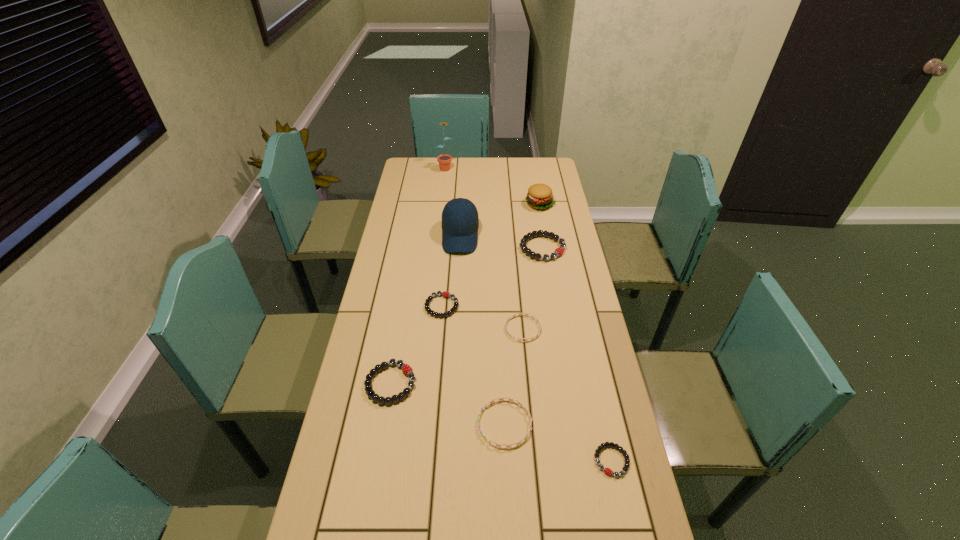
I want to click on blue bracelet that is the second closest to the baseball cap, so click(x=490, y=402).

Locate an element on the screen. blank space that satisfies the following two spatial constraints: 1. on the front-facing side of the blue baseball cap; 2. on the left side of the smallest black bracelet is located at coordinates (448, 461).

Where is `vacant position in the image that satisfies the following two spatial constraints: 1. on the back side of the third nearest black bracelet; 2. on the right side of the third farthest black bracelet`? Image resolution: width=960 pixels, height=540 pixels. vacant position in the image that satisfies the following two spatial constraints: 1. on the back side of the third nearest black bracelet; 2. on the right side of the third farthest black bracelet is located at coordinates (404, 306).